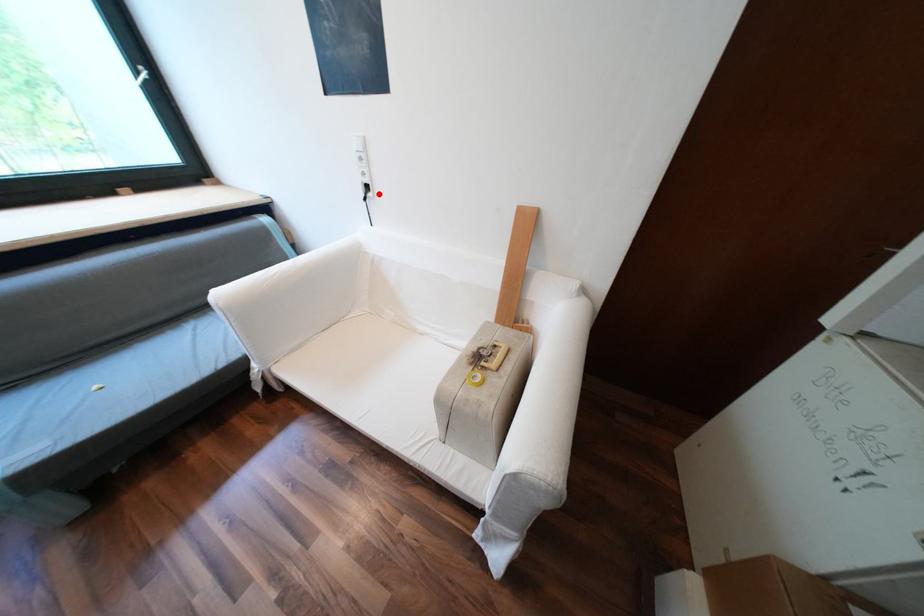
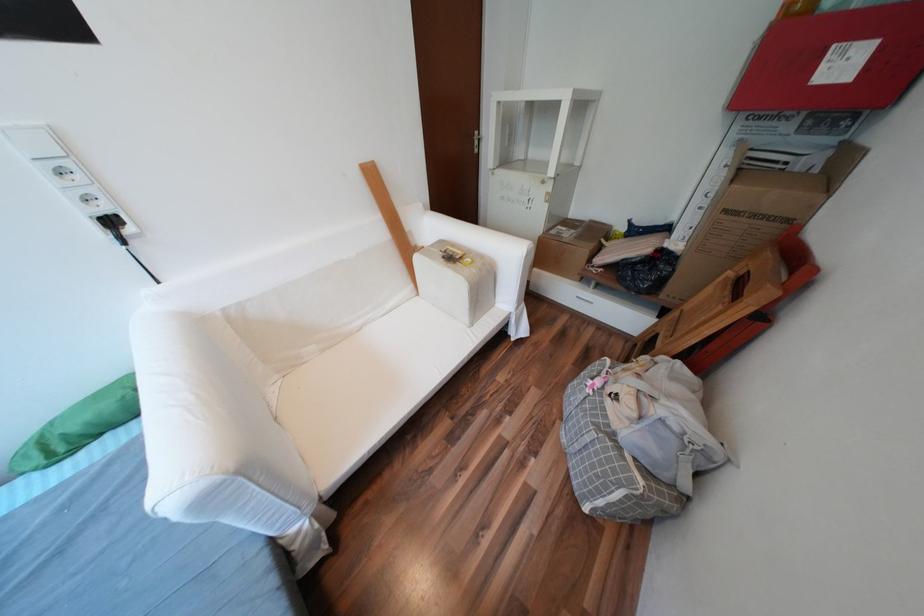
Question: I am providing you with two images of the same scene from different viewpoints. Image1 has a red point marked. In image2, the corresponding 3D location appears at what relative position? Reply with the corresponding letter.

Choices:
 (A) Closer
 (B) Farther

Answer: (B)